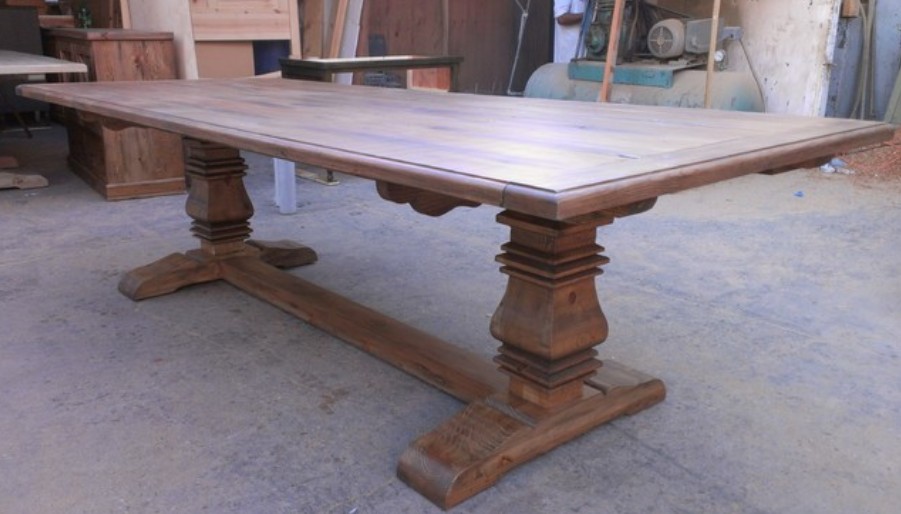
The height and width of the screenshot is (514, 901). Find the location of `cement floor`. cement floor is located at coordinates (808, 374), (252, 469).